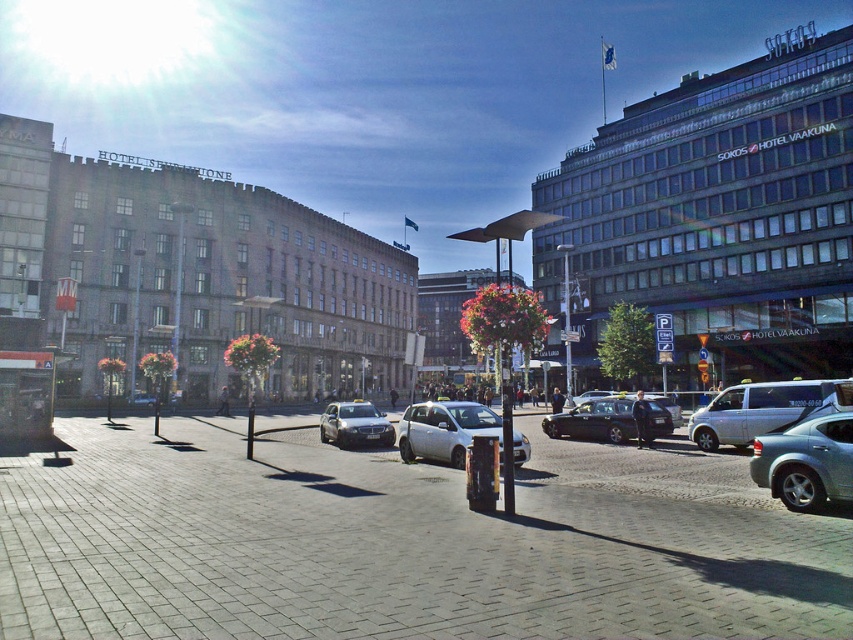
Based on the photo, does metallic silver sedan at lower right appear over shiny black sedan at center?

Yes.

Which is behind, point (786, 477) or point (585, 401)?

The point (585, 401) is behind.

What do you see at coordinates (805, 461) in the screenshot? I see `metallic silver sedan at lower right` at bounding box center [805, 461].

Locate an element on the screen. The image size is (853, 640). metallic silver sedan at lower right is located at coordinates (805, 461).

Is point (457, 401) closer to camera compared to point (335, 406)?

No, it is behind (335, 406).

Which of these two, white matte car at center or silver metallic sedan at center, stands shorter?

With less height is silver metallic sedan at center.

This screenshot has width=853, height=640. What do you see at coordinates (444, 429) in the screenshot? I see `white matte car at center` at bounding box center [444, 429].

Locate an element on the screen. This screenshot has width=853, height=640. white matte car at center is located at coordinates (444, 429).

Is point (618, 436) more distant than point (332, 419)?

No.

Is shiny black sedan at center shorter than silver metallic sedan at center?

Yes.

What do you see at coordinates (595, 420) in the screenshot? This screenshot has width=853, height=640. I see `shiny black sedan at center` at bounding box center [595, 420].

Locate an element on the screen. This screenshot has width=853, height=640. shiny black sedan at center is located at coordinates (595, 420).